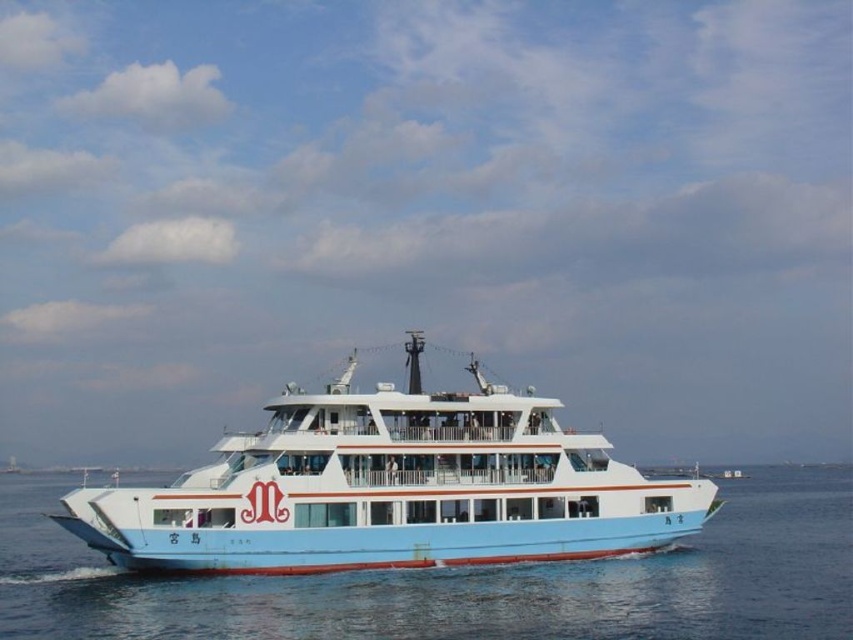
Question: Observing the image, what is the correct spatial positioning of light blue plastic boat at center in reference to blue water at center?

Choices:
 (A) above
 (B) below

Answer: (A)

Question: Is light blue plastic boat at center in front of blue water at center?

Choices:
 (A) yes
 (B) no

Answer: (B)

Question: Among these objects, which one is farthest from the camera?

Choices:
 (A) blue water at center
 (B) light blue plastic boat at center

Answer: (B)

Question: Among these points, which one is farthest from the camera?

Choices:
 (A) (375, 554)
 (B) (689, 634)

Answer: (A)

Question: From the image, what is the correct spatial relationship of light blue plastic boat at center in relation to blue water at center?

Choices:
 (A) right
 (B) left

Answer: (B)